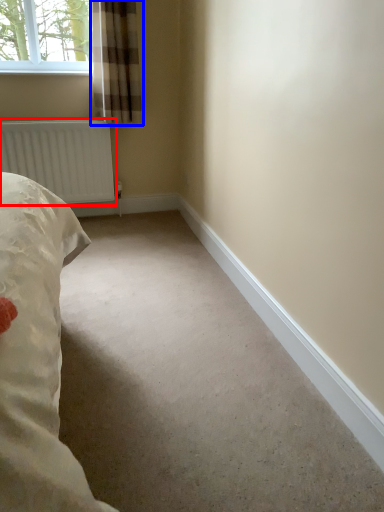
Question: Which object is further to the camera taking this photo, radiator (highlighted by a red box) or curtain (highlighted by a blue box)?

Choices:
 (A) radiator
 (B) curtain

Answer: (A)